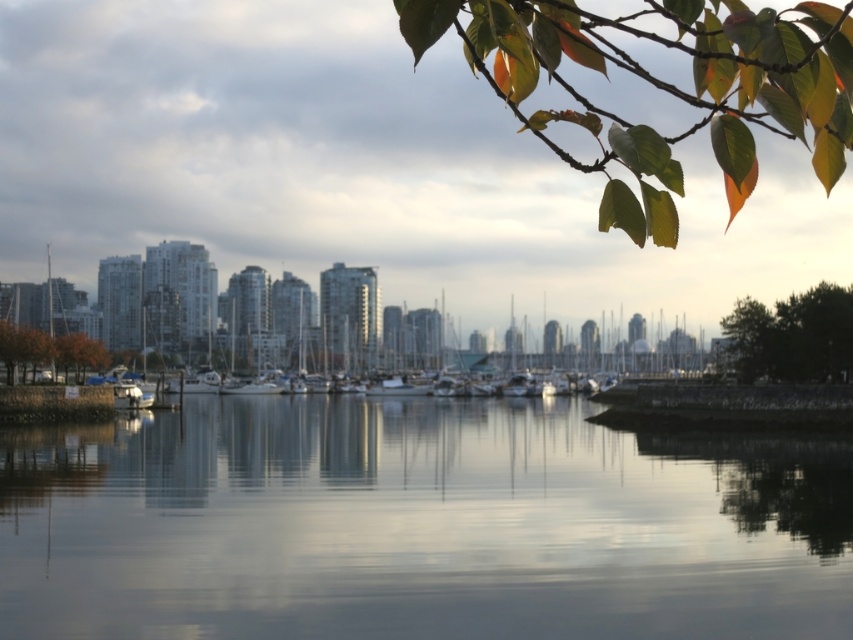
Is clear water at center smaller than green leafy branch at upper right?

Actually, clear water at center might be larger than green leafy branch at upper right.

Does point (631, 584) come behind point (560, 48)?

Yes, point (631, 584) is farther from viewer.

Between point (653, 524) and point (717, 0), which one is positioned behind?

Point (653, 524)

Where is `clear water at center`? The height and width of the screenshot is (640, 853). clear water at center is located at coordinates (416, 524).

Between point (53, 358) and point (662, 344), which one is positioned behind?

Point (662, 344)

Between point (16, 328) and point (670, 371), which one is positioned in front?

Point (16, 328) is more forward.

Measure the distance between point (x=19, y=332) and camera.

81.13 meters

Where is `orange matte tree at left`? orange matte tree at left is located at coordinates click(48, 349).

Does point (730, 484) lie in front of point (672, 348)?

Yes, it is.

Is point (444, 586) more distant than point (671, 348)?

No.

In order to click on clear water at center in this screenshot , I will do `click(416, 524)`.

Image resolution: width=853 pixels, height=640 pixels. Find the location of `clear water at center`. clear water at center is located at coordinates (416, 524).